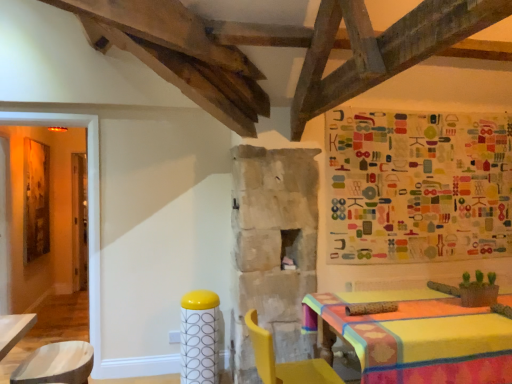
Question: Is multicolored fabric tapestry at upper right at the left side of yellow plastic chair at lower right?

Choices:
 (A) yes
 (B) no

Answer: (B)

Question: Does multicolored fabric tapestry at upper right have a greater width compared to yellow plastic chair at lower right?

Choices:
 (A) no
 (B) yes

Answer: (A)

Question: From a real-world perspective, is multicolored fabric tapestry at upper right positioned over yellow plastic chair at lower right based on gravity?

Choices:
 (A) no
 (B) yes

Answer: (B)

Question: From a real-world perspective, is multicolored fabric tapestry at upper right positioned under yellow plastic chair at lower right based on gravity?

Choices:
 (A) no
 (B) yes

Answer: (A)

Question: Is multicolored fabric tapestry at upper right positioned far away from yellow plastic chair at lower right?

Choices:
 (A) yes
 (B) no

Answer: (A)

Question: From the image's perspective, is multicolored fabric tapestry at upper right on yellow plastic chair at lower right?

Choices:
 (A) yes
 (B) no

Answer: (A)

Question: Does yellow plastic chair at lower right have a lesser height compared to yellow glossy bar stool at center?

Choices:
 (A) no
 (B) yes

Answer: (B)

Question: Does yellow plastic chair at lower right appear on the left side of yellow glossy bar stool at center?

Choices:
 (A) yes
 (B) no

Answer: (B)

Question: Considering the relative sizes of yellow plastic chair at lower right and yellow glossy bar stool at center in the image provided, is yellow plastic chair at lower right thinner than yellow glossy bar stool at center?

Choices:
 (A) no
 (B) yes

Answer: (A)

Question: Is the position of yellow plastic chair at lower right more distant than that of yellow glossy bar stool at center?

Choices:
 (A) yes
 (B) no

Answer: (B)

Question: Does yellow plastic chair at lower right have a greater height compared to yellow glossy bar stool at center?

Choices:
 (A) yes
 (B) no

Answer: (B)

Question: Is the depth of yellow plastic chair at lower right less than that of yellow glossy bar stool at center?

Choices:
 (A) no
 (B) yes

Answer: (B)

Question: Is yellow glossy bar stool at center completely or partially outside of yellow plastic chair at lower right?

Choices:
 (A) yes
 (B) no

Answer: (A)